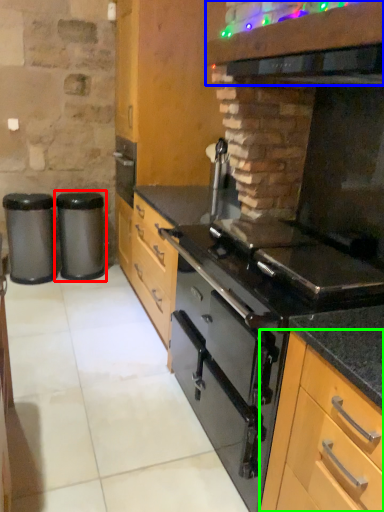
Question: Which object is the farthest from waste container (highlighted by a red box)? Choose among these: vent (highlighted by a blue box) or cabinetry (highlighted by a green box).

Choices:
 (A) vent
 (B) cabinetry

Answer: (B)